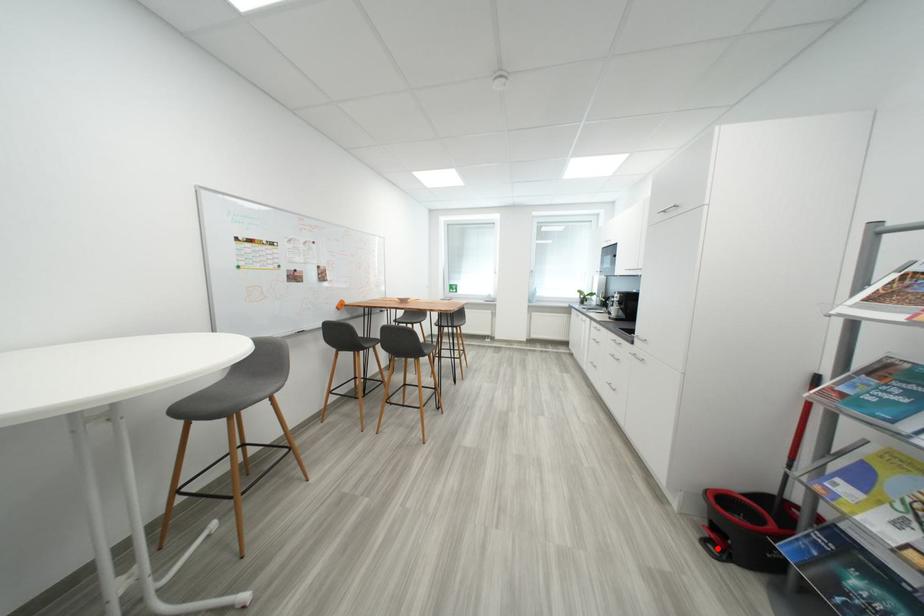
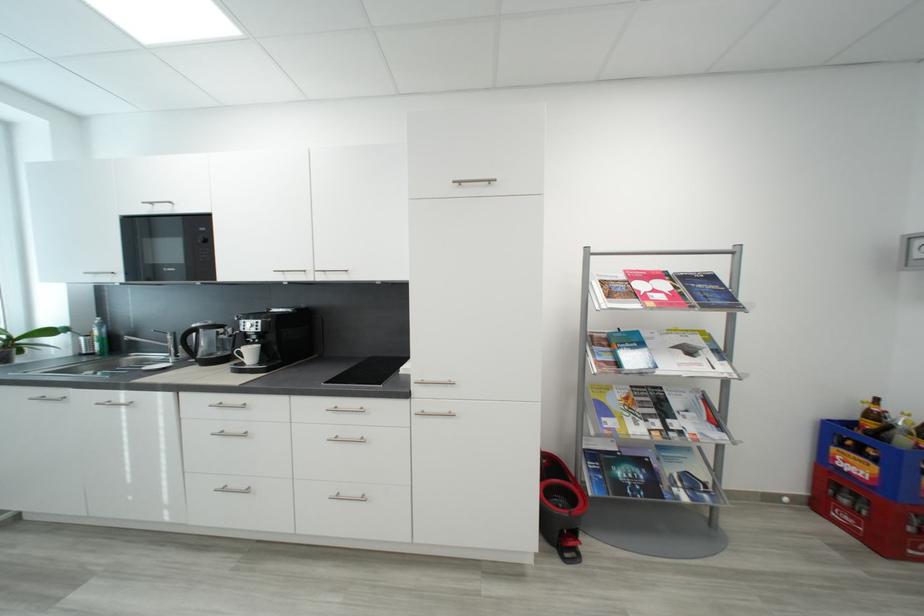
Find the pixel in the second image that matches the highlighted location in the first image.

(574, 557)